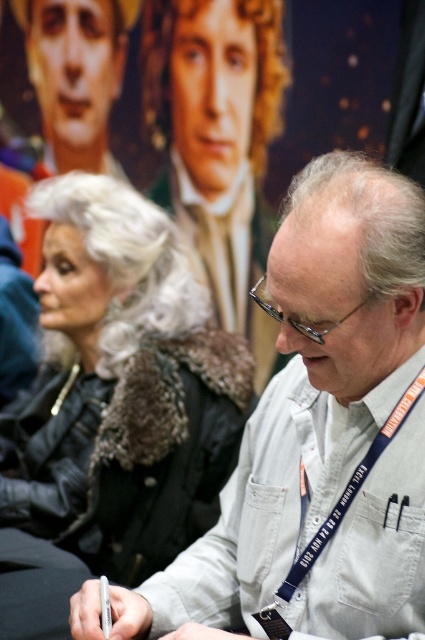
Question: Which of the following is the closest to the observer?

Choices:
 (A) (70, 19)
 (B) (215, 131)

Answer: (B)

Question: Is black leather jacket at center below smooth silver hair at upper center?

Choices:
 (A) yes
 (B) no

Answer: (A)

Question: Which of these objects is positioned closest to the white cotton shirt at center?

Choices:
 (A) smooth silver hair at upper center
 (B) black leather jacket at center
 (C) white textured shirt at center

Answer: (B)

Question: Estimate the real-world distances between objects in this image. Which object is farther from the smooth silver hair at upper center?

Choices:
 (A) white textured shirt at center
 (B) white cotton shirt at center

Answer: (B)

Question: Does white textured shirt at center appear under smooth silver hair at upper center?

Choices:
 (A) yes
 (B) no

Answer: (A)

Question: Is white cotton shirt at center to the right of smooth silver hair at upper center from the viewer's perspective?

Choices:
 (A) no
 (B) yes

Answer: (B)